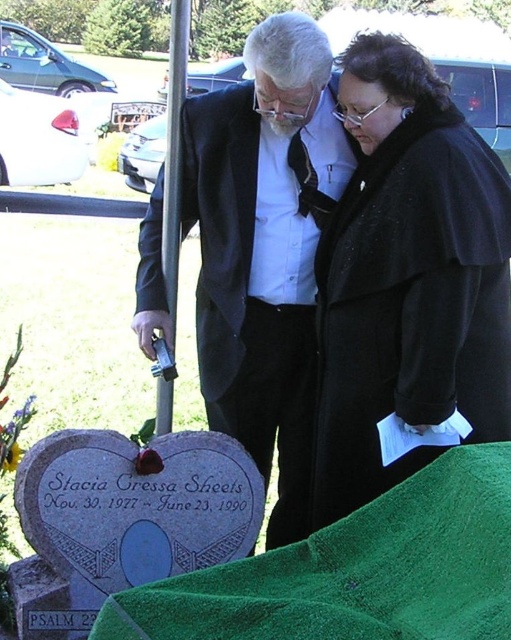
Question: Does black wool coat at center appear under green fabric at lower center?

Choices:
 (A) no
 (B) yes

Answer: (A)

Question: Estimate the real-world distances between objects in this image. Which object is closer to the matte black suit at center?

Choices:
 (A) green fabric at lower center
 (B) black wool coat at center

Answer: (B)

Question: Which point is farther from the camera taking this photo?

Choices:
 (A) (x=508, y=419)
 (B) (x=467, y=506)

Answer: (A)

Question: Which point is farther from the camera taking this photo?

Choices:
 (A) (365, 564)
 (B) (378, 262)

Answer: (B)

Question: From the image, what is the correct spatial relationship of black wool coat at center in relation to matte black suit at center?

Choices:
 (A) below
 (B) above

Answer: (B)

Question: Is matte black suit at center to the right of green fabric at lower center from the viewer's perspective?

Choices:
 (A) yes
 (B) no

Answer: (B)